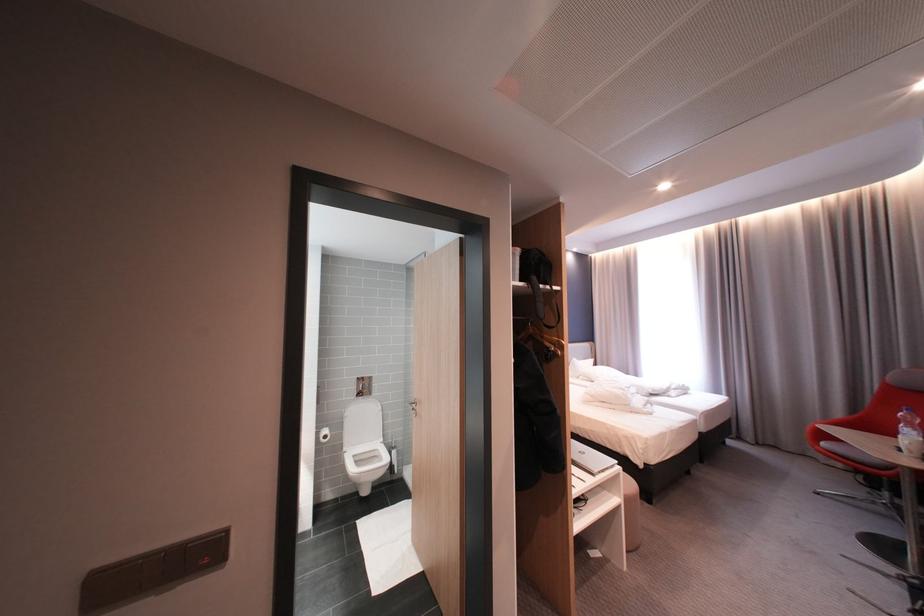
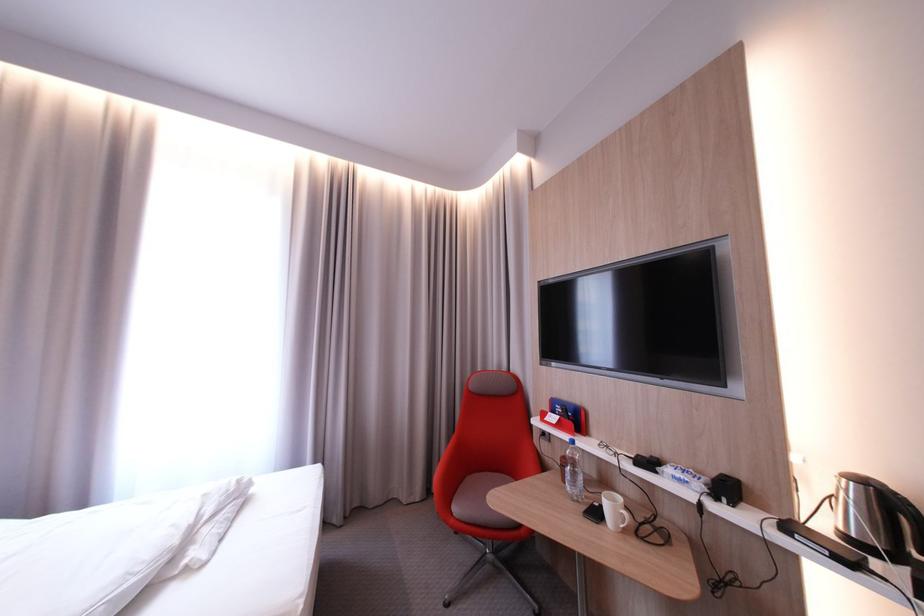
In the second image, find the point that corresponds to pixel 834 445 in the first image.

(467, 511)